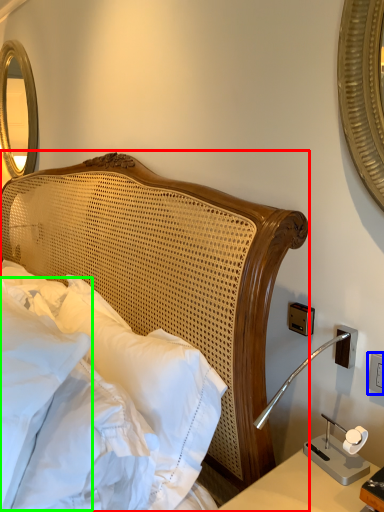
Question: Based on their relative distances, which object is farther from bed (highlighted by a red box)? Choose from electric outlet (highlighted by a blue box) and pillow (highlighted by a green box).

Choices:
 (A) electric outlet
 (B) pillow

Answer: (A)